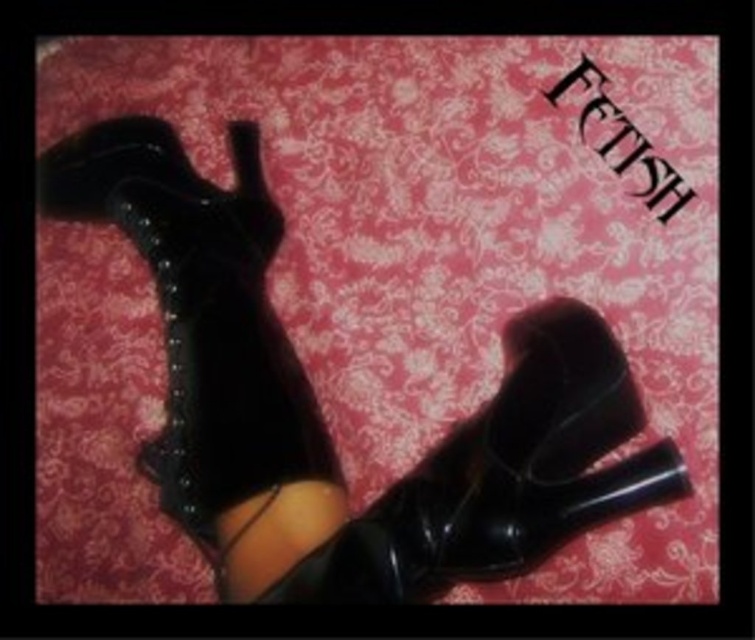
Can you confirm if shiny patent leather boots at lower right is positioned above leather studded boots at left?

No.

Is shiny patent leather boots at lower right smaller than leather studded boots at left?

Incorrect, shiny patent leather boots at lower right is not smaller in size than leather studded boots at left.

Is point (547, 522) positioned after point (233, 253)?

No, it is in front of (233, 253).

This screenshot has height=640, width=755. What are the coordinates of `shiny patent leather boots at lower right` in the screenshot? It's located at (319, 408).

Between point (202, 538) and point (521, 556), which one is positioned in front?

Positioned in front is point (521, 556).

Is shiny patent leather boots at lower right to the right of black patent leather boot at center from the viewer's perspective?

Incorrect, shiny patent leather boots at lower right is not on the right side of black patent leather boot at center.

The width and height of the screenshot is (755, 640). Find the location of `shiny patent leather boots at lower right`. shiny patent leather boots at lower right is located at coordinates (319, 408).

Where is `shiny patent leather boots at lower right`? The width and height of the screenshot is (755, 640). shiny patent leather boots at lower right is located at coordinates (319, 408).

Which of these two, leather studded boots at left or black patent leather boot at center, stands shorter?

black patent leather boot at center

Can you confirm if leather studded boots at left is shorter than black patent leather boot at center?

No.

What do you see at coordinates (202, 314) in the screenshot? I see `leather studded boots at left` at bounding box center [202, 314].

What are the coordinates of `leather studded boots at left` in the screenshot? It's located at (202, 314).